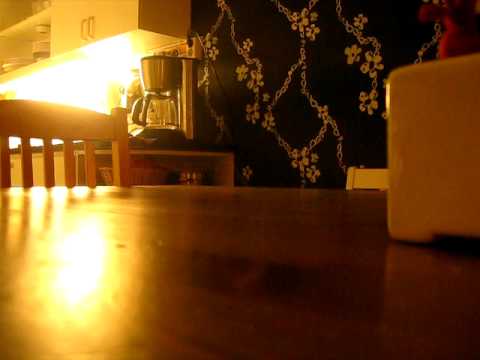
Where is `table`? This screenshot has height=360, width=480. table is located at coordinates (289, 216).